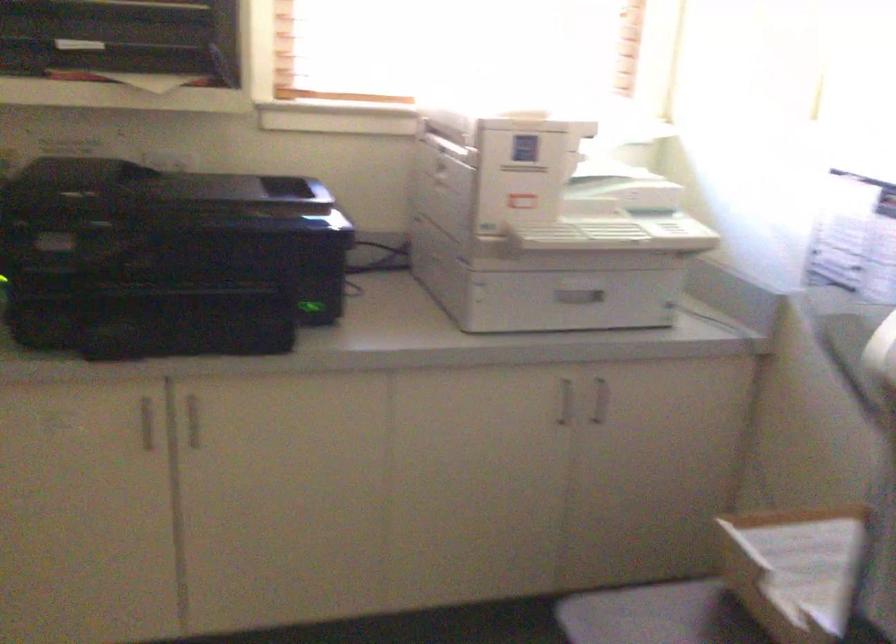
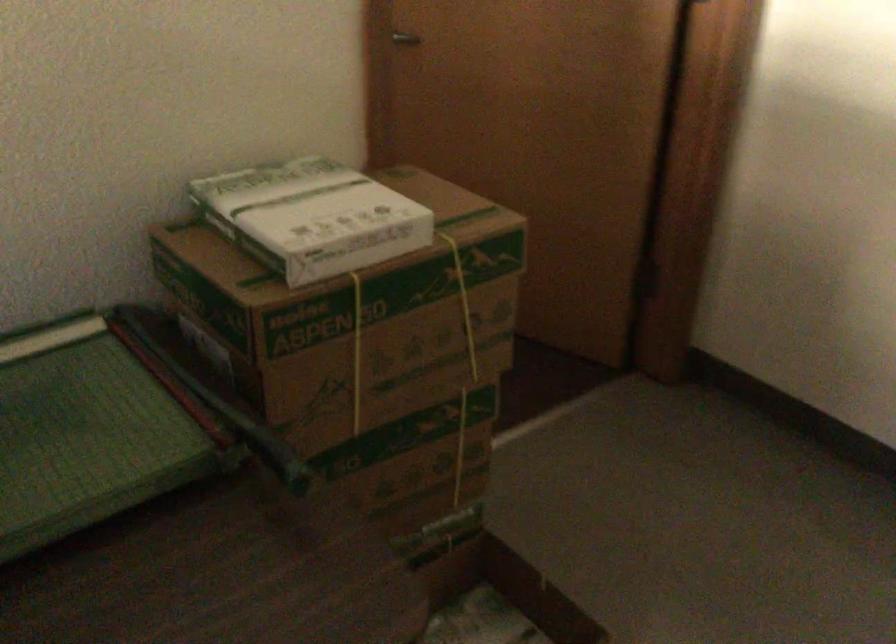
The images are taken continuously from a first-person perspective. In which direction is your viewpoint rotating?

The rotation direction of the camera is right-down.